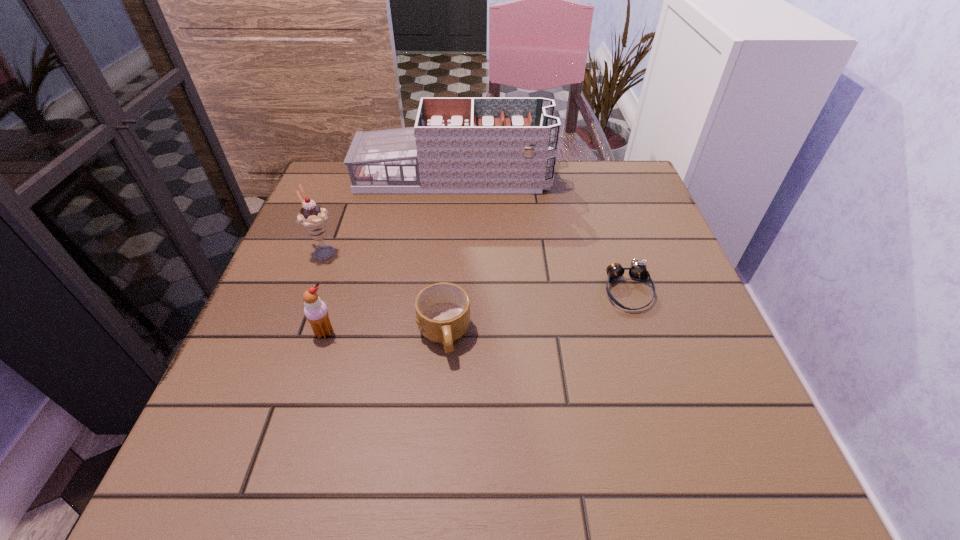
Find the location of a particular element. Image resolution: width=960 pixels, height=540 pixels. dollhouse is located at coordinates [x=458, y=145].

At what (x,y) coordinates should I click in order to perform the action: click on the farther icecream. Please return your answer as a coordinate pair (x, y). Looking at the image, I should click on (312, 217).

Where is `the left icecream`? the left icecream is located at coordinates (312, 217).

Where is `the right icecream`? This screenshot has width=960, height=540. the right icecream is located at coordinates (315, 310).

Where is `the shorter icecream`? the shorter icecream is located at coordinates (315, 310).

Where is `mug`? The height and width of the screenshot is (540, 960). mug is located at coordinates (443, 309).

Where is `the rightmost object`? The height and width of the screenshot is (540, 960). the rightmost object is located at coordinates (637, 271).

What are the coordinates of `the shortest object` in the screenshot? It's located at (637, 271).

At what (x,y) coordinates should I click in order to perform the action: click on blank space located 0.100m at the entrance of the farthest object. Please return your answer as a coordinate pair (x, y). This screenshot has width=960, height=540. Looking at the image, I should click on coord(588,177).

The width and height of the screenshot is (960, 540). Identify the location of free space located on the back of the left icecream. (334, 224).